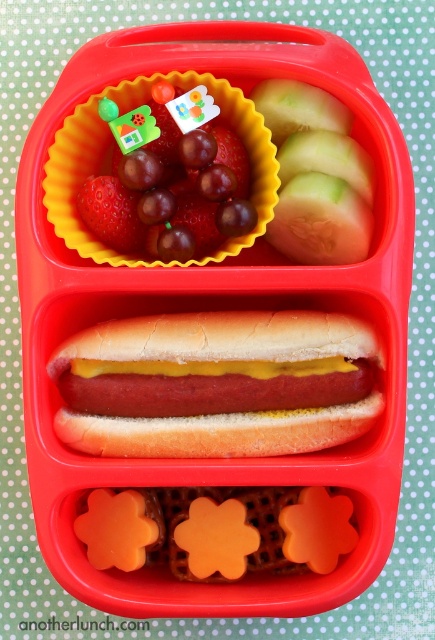
Question: Can you confirm if yellow mustard hot dog at center is positioned below shiny red grapes at upper left?

Choices:
 (A) no
 (B) yes

Answer: (B)

Question: Can you confirm if yellow mustard hot dog at center is bigger than shiny red grapes at upper left?

Choices:
 (A) yes
 (B) no

Answer: (B)

Question: Which of the following is the closest to the observer?

Choices:
 (A) (294, 412)
 (B) (203, 168)

Answer: (B)

Question: Can you confirm if yellow mustard hot dog at center is thinner than shiny red grapes at upper left?

Choices:
 (A) yes
 (B) no

Answer: (B)

Question: Among these points, which one is farthest from the camera?

Choices:
 (A) (160, 328)
 (B) (147, 253)

Answer: (B)